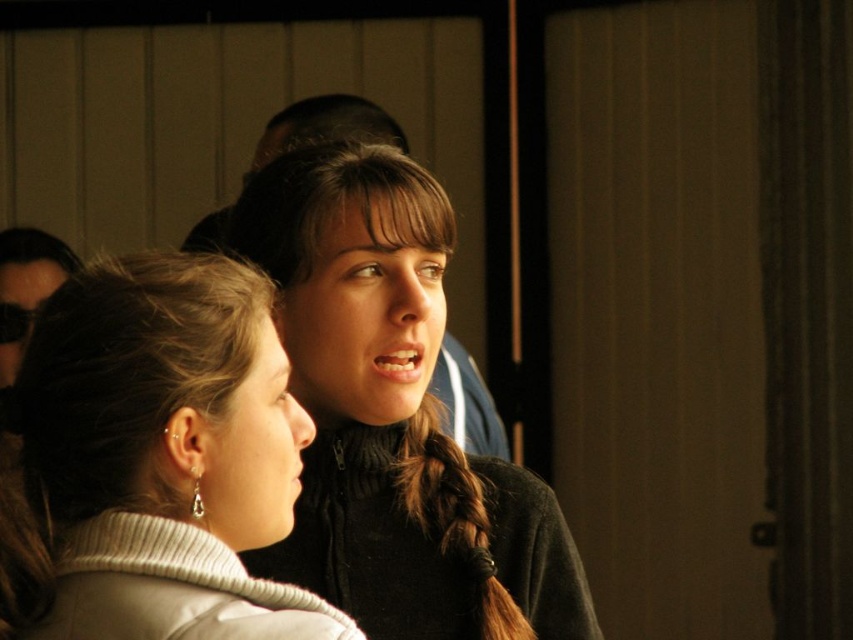
You are standing in the scene and need to locate the white matte sweater at center. Can you describe its exact position using coordinates?

The white matte sweater at center is located at coordinates point (158, 458).